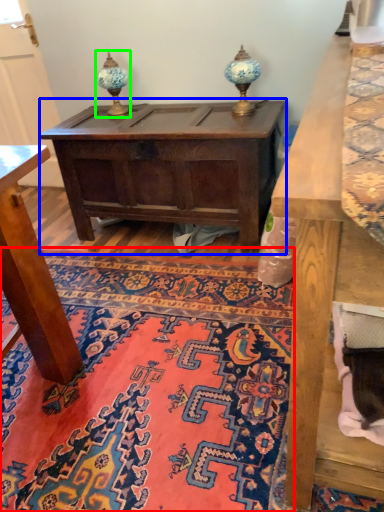
Question: Which object is the closest to the mat (highlighted by a red box)? Choose among these: table (highlighted by a blue box) or table lamp (highlighted by a green box).

Choices:
 (A) table
 (B) table lamp

Answer: (A)